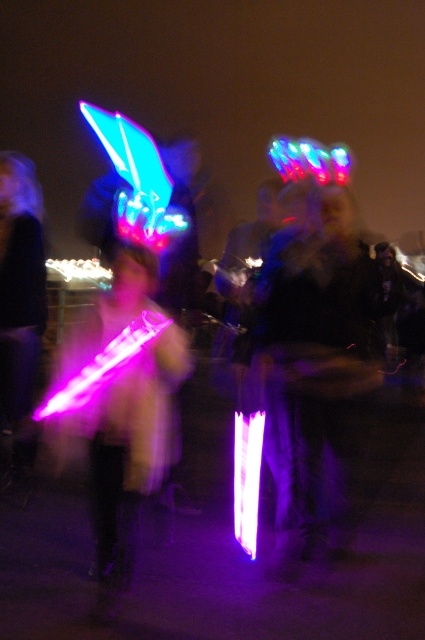
You are at a nighttime event and see two glowing items at the center of your view. Which one is positioned to the right between the neon plastic light stick at center and the glowing plastic sword at center?

The neon plastic light stick at center is positioned to the right of the glowing plastic sword at center.

You are a photographer trying to capture a clear photo of the neon plastic light stick at center and the glowing plastic sword at center during the festival. The camera requires both objects to be within a 20 inch focus range to capture them sharply. Can you take the photo with both objects in focus?

The neon plastic light stick at center is 25.54 inches away from the glowing plastic sword at center. Since the distance between them exceeds the camera requirement of 20 inches, the camera cannot focus on both objects simultaneously, so the photo will not be sharp for both.